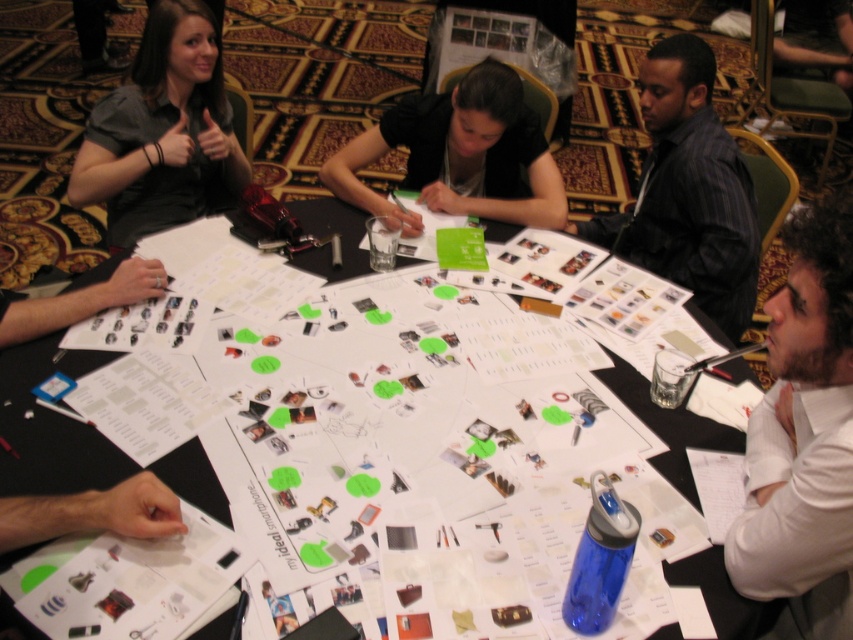
You are a participant in the brainstorming session and need to place a new idea on the white paper at center. Where exactly should you place it to ensure it is centered on the paper?

The white paper at center is located at point (50, 426), so placing the new idea at those coordinates will center it on the paper.

Looking at this image, you are standing at the entrance of the room and see the point at coordinates [688,192]. Which object is located at that position?

The point at coordinates [688,192] corresponds to the dark striped shirt at upper right.